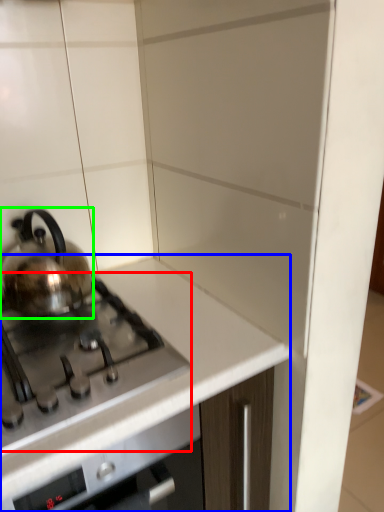
Question: Considering the real-world distances, which object is farthest from gas stove (highlighted by a red box)? countertop (highlighted by a blue box) or kettle (highlighted by a green box)?

Choices:
 (A) countertop
 (B) kettle

Answer: (B)